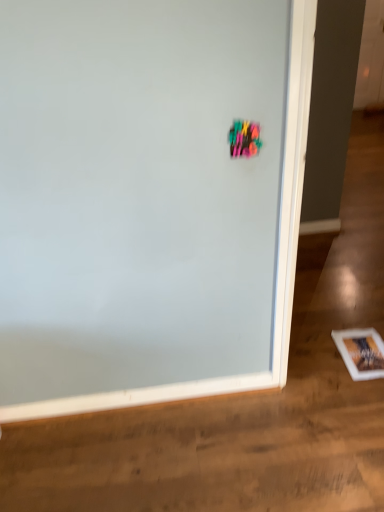
This screenshot has height=512, width=384. Find the location of `white matte picture frame at lower right`. white matte picture frame at lower right is located at coordinates (361, 352).

Describe the element at coordinates (361, 352) in the screenshot. I see `white matte picture frame at lower right` at that location.

In the scene shown: Measure the distance between point (352,344) and camera.

Point (352,344) is 6.41 feet away from camera.

Identify the location of white matte picture frame at lower right. (361, 352).